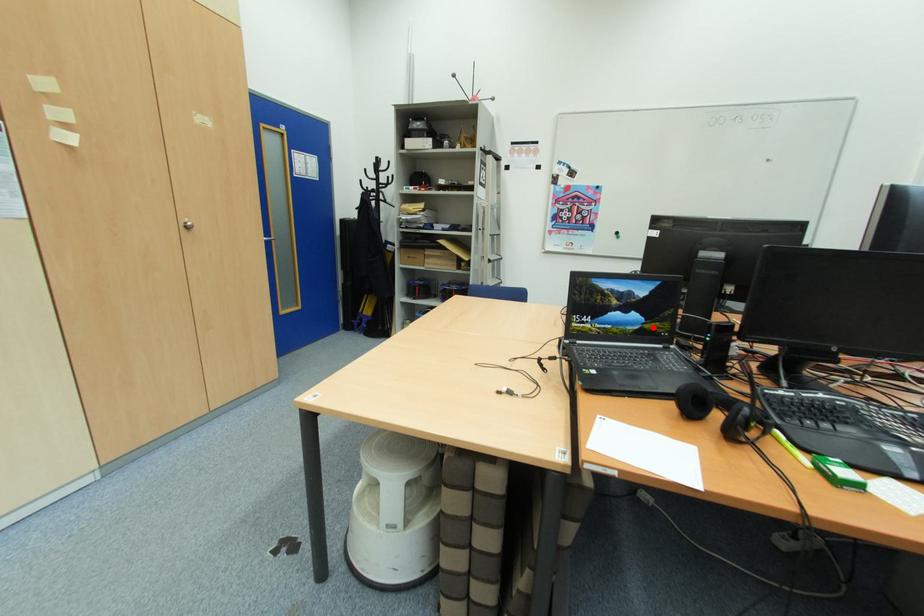
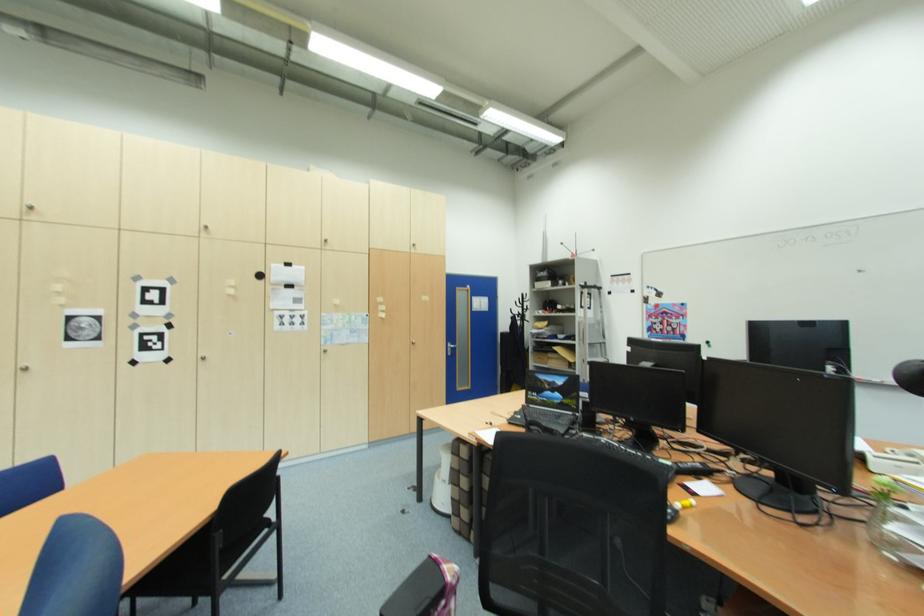
Where in the second image is the point corresponding to the highlighted location from the first image?

(569, 402)